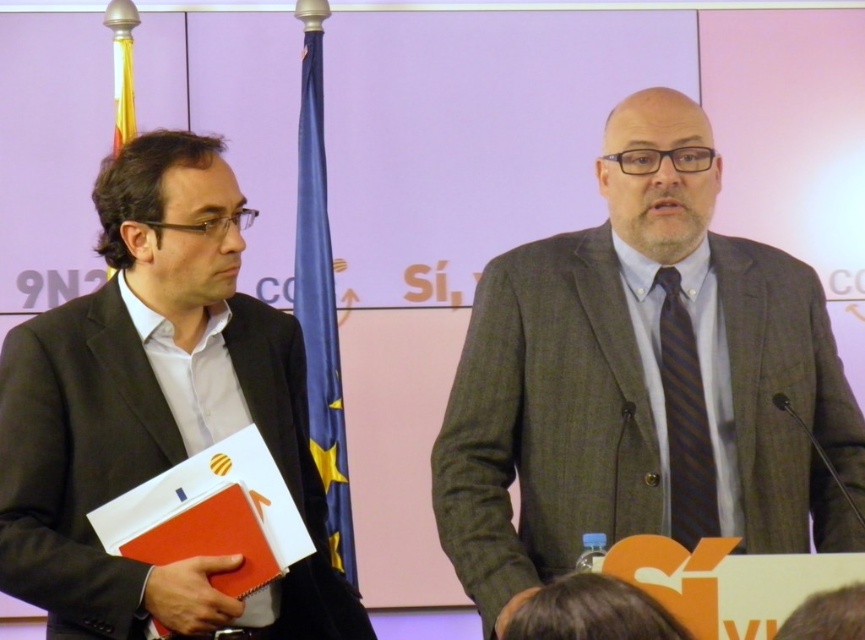
Question: Based on their relative distances, which object is farther from the matte black suit at left?

Choices:
 (A) dark blue striped tie at center
 (B) gray wool suit at center

Answer: (A)

Question: Which of the following is the closest to the observer?

Choices:
 (A) (152, 193)
 (B) (550, 500)
 (C) (697, 401)

Answer: (C)

Question: Does gray wool suit at center appear on the left side of matte black suit at left?

Choices:
 (A) no
 (B) yes

Answer: (A)

Question: Observing the image, what is the correct spatial positioning of gray wool suit at center in reference to matte black suit at left?

Choices:
 (A) left
 (B) right

Answer: (B)

Question: Which point is farther from the camera taking this photo?

Choices:
 (A) (665, 276)
 (B) (36, 554)
 (C) (535, 336)

Answer: (C)

Question: Is gray wool suit at center to the left of dark blue striped tie at center from the viewer's perspective?

Choices:
 (A) no
 (B) yes

Answer: (B)